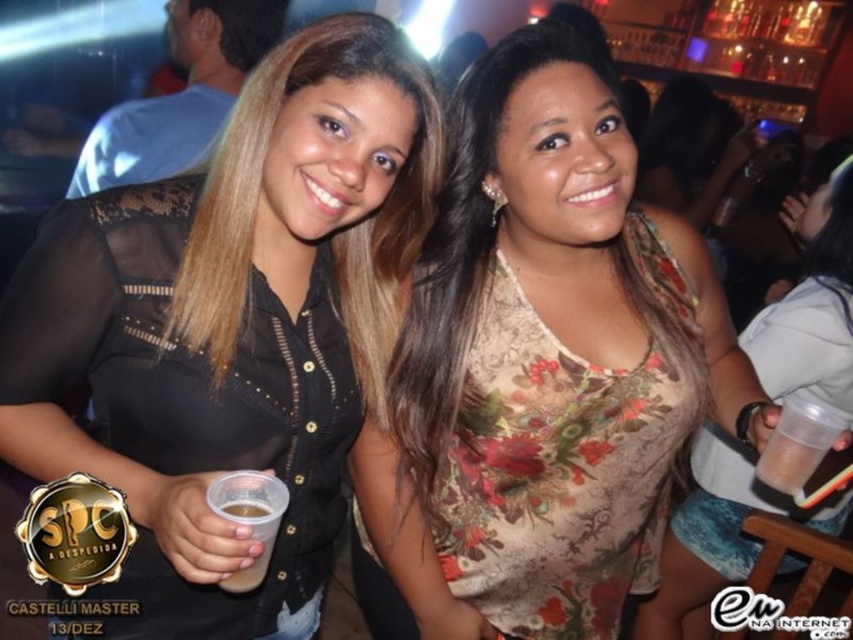
Does black lace shirt at left have a lesser height compared to floral-patterned fabric dress at center?

Yes, black lace shirt at left is shorter than floral-patterned fabric dress at center.

This screenshot has width=853, height=640. In order to click on black lace shirt at left in this screenshot , I will do `click(230, 330)`.

Where is `black lace shirt at left`? This screenshot has height=640, width=853. black lace shirt at left is located at coordinates (230, 330).

Based on the photo, is black lace shirt at left to the left of floral-patterned top at center from the viewer's perspective?

Yes, black lace shirt at left is to the left of floral-patterned top at center.

Describe the element at coordinates (230, 330) in the screenshot. The height and width of the screenshot is (640, 853). I see `black lace shirt at left` at that location.

Find the location of a particular element. The width and height of the screenshot is (853, 640). black lace shirt at left is located at coordinates (230, 330).

Looking at this image, which of these two, floral-patterned top at center or translucent plastic cup at center, stands shorter?

With less height is translucent plastic cup at center.

Who is taller, floral-patterned top at center or translucent plastic cup at center?

floral-patterned top at center is taller.

Is point (686, 285) more distant than point (241, 500)?

Yes, it is.

Where is `floral-patterned top at center`? floral-patterned top at center is located at coordinates (541, 369).